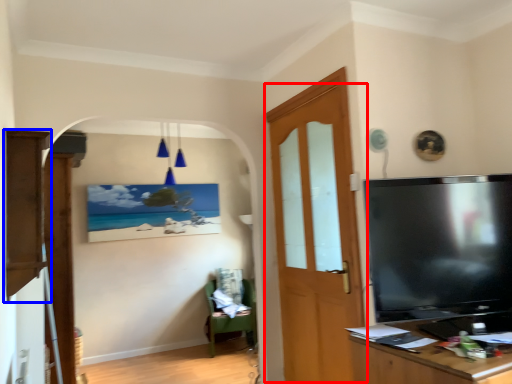
Question: Which object is closer to the camera taking this photo, door (highlighted by a red box) or cabinetry (highlighted by a blue box)?

Choices:
 (A) door
 (B) cabinetry

Answer: (B)